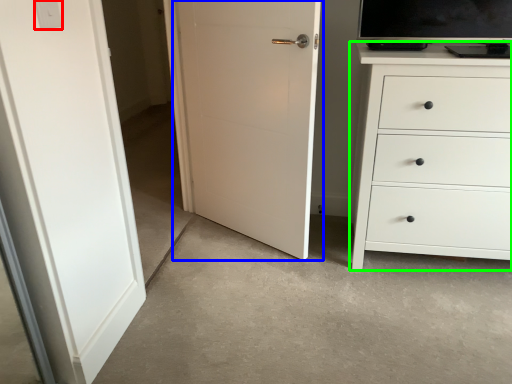
Question: Considering the real-world distances, which object is farthest from light switch (highlighted by a red box)? door (highlighted by a blue box) or chest of drawers (highlighted by a green box)?

Choices:
 (A) door
 (B) chest of drawers

Answer: (B)